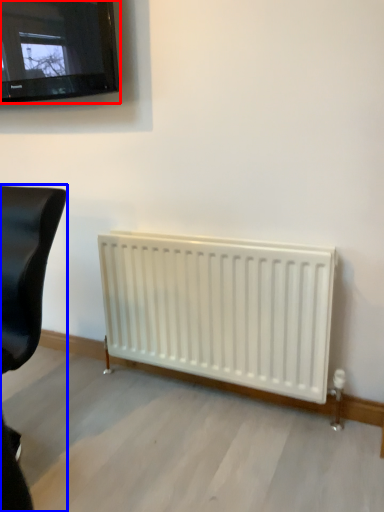
Question: Which object is closer to the camera taking this photo, television (highlighted by a red box) or furniture (highlighted by a blue box)?

Choices:
 (A) television
 (B) furniture

Answer: (B)